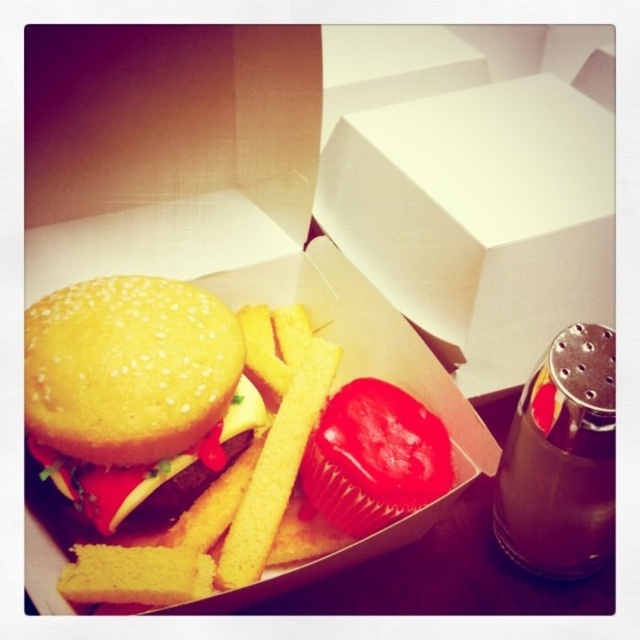
You are a food delivery person who needs to place a black plastic salt shaker at right into the white cardboard box without touching the yellow crispy french fries at center. Is there enough space to the right of the fries to place the salt shaker?

The yellow crispy french fries at center is positioned on the left side of black plastic salt shaker at right, so there is enough space to the right of the fries to place the salt shaker without touching them.